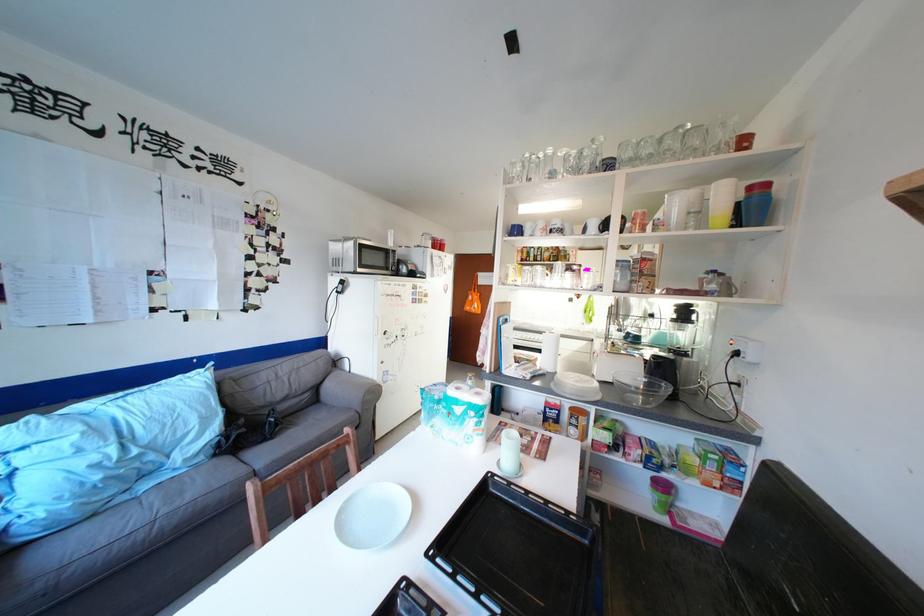
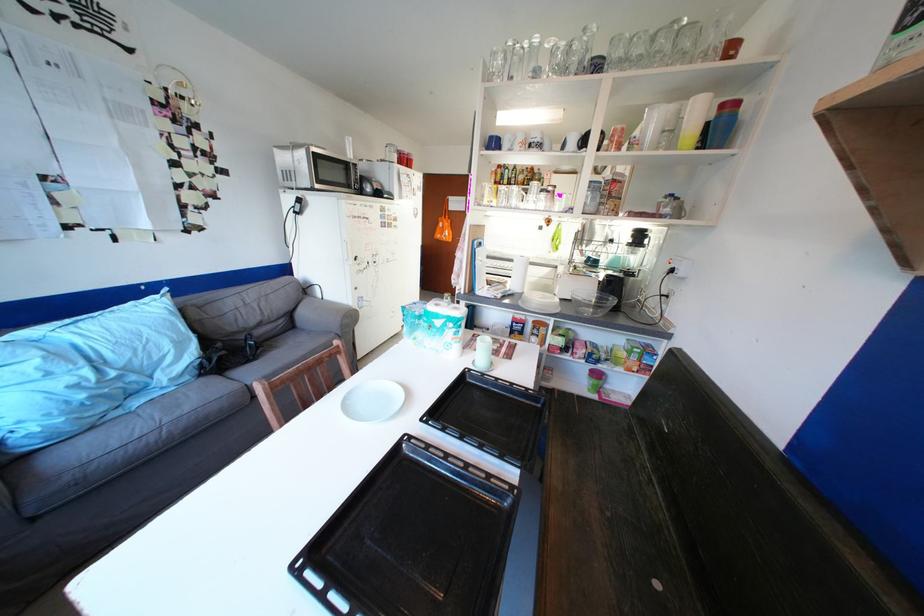
The point at [578,302] is marked in the first image. Where is the corresponding point in the second image?

(548, 230)